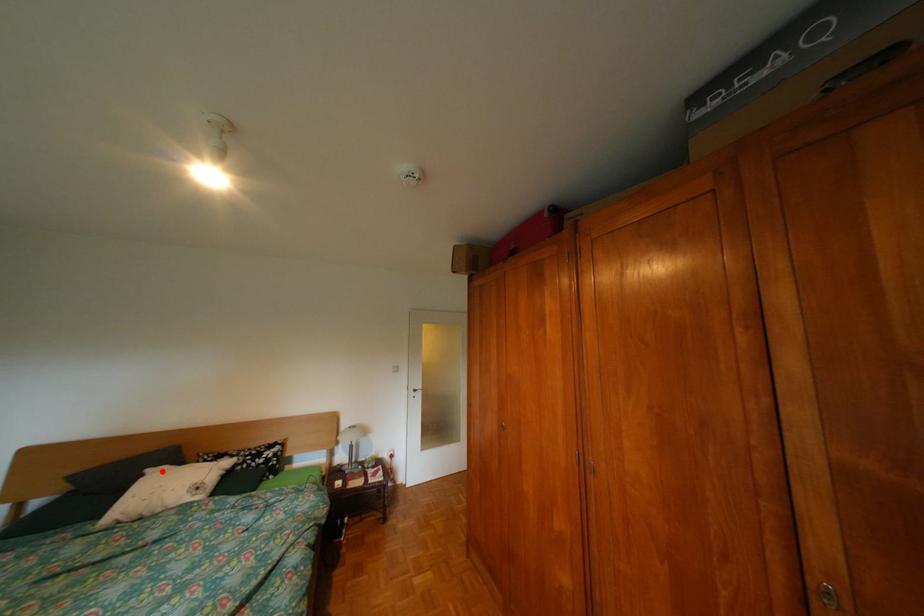
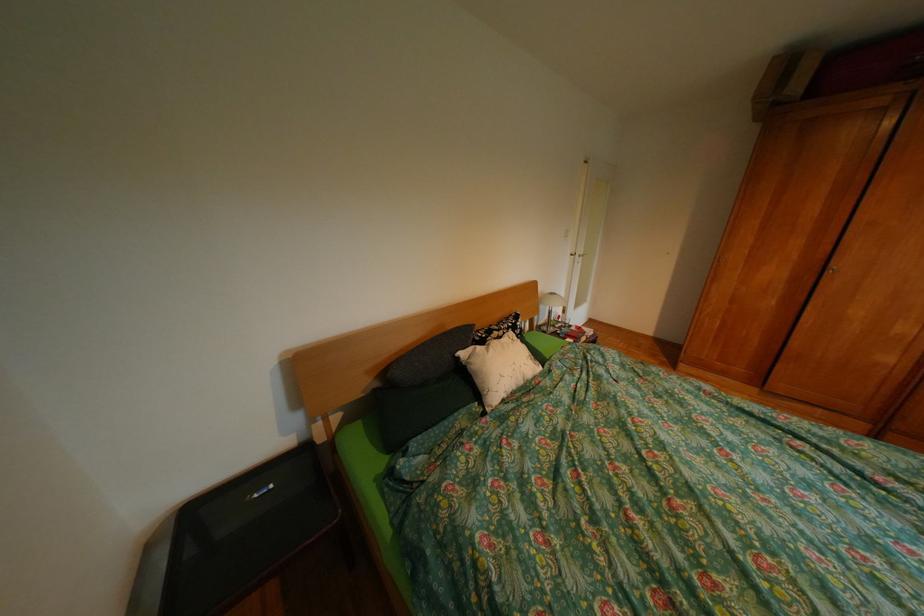
In the second image, find the point that corresponds to the highlighted location in the first image.

(477, 354)